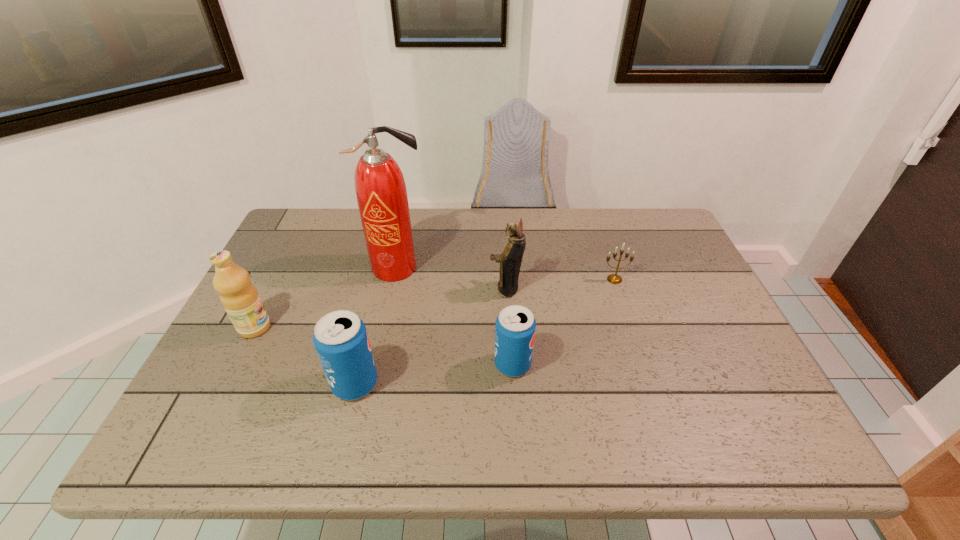
In the image, there is a desktop. At what (x,y) coordinates should I click in order to perform the action: click on free space at the near edge. Please return your answer as a coordinate pair (x, y). Looking at the image, I should click on (657, 377).

The width and height of the screenshot is (960, 540). Find the location of `vacant space at the left edge of the desktop`. vacant space at the left edge of the desktop is located at coordinates (252, 376).

Image resolution: width=960 pixels, height=540 pixels. Identify the location of free region at the right edge of the desktop. (693, 299).

I want to click on vacant point at the far left corner, so click(x=332, y=211).

Locate an element on the screen. The height and width of the screenshot is (540, 960). vacant space that is in between the tallest object and the right soda can is located at coordinates (455, 316).

Find the location of a particular element. free area in between the shortest object and the olive oil is located at coordinates (435, 303).

Find the location of `empty space that is in between the figurine and the left soda can`. empty space that is in between the figurine and the left soda can is located at coordinates (430, 336).

Where is `blank region between the right soda can and the fire extinguisher`? Image resolution: width=960 pixels, height=540 pixels. blank region between the right soda can and the fire extinguisher is located at coordinates (455, 316).

In order to click on vacant space that's between the leftmost object and the shortest object in this screenshot , I will do `click(435, 303)`.

The width and height of the screenshot is (960, 540). Find the location of `free area in between the figurine and the third shortest object`. free area in between the figurine and the third shortest object is located at coordinates (430, 336).